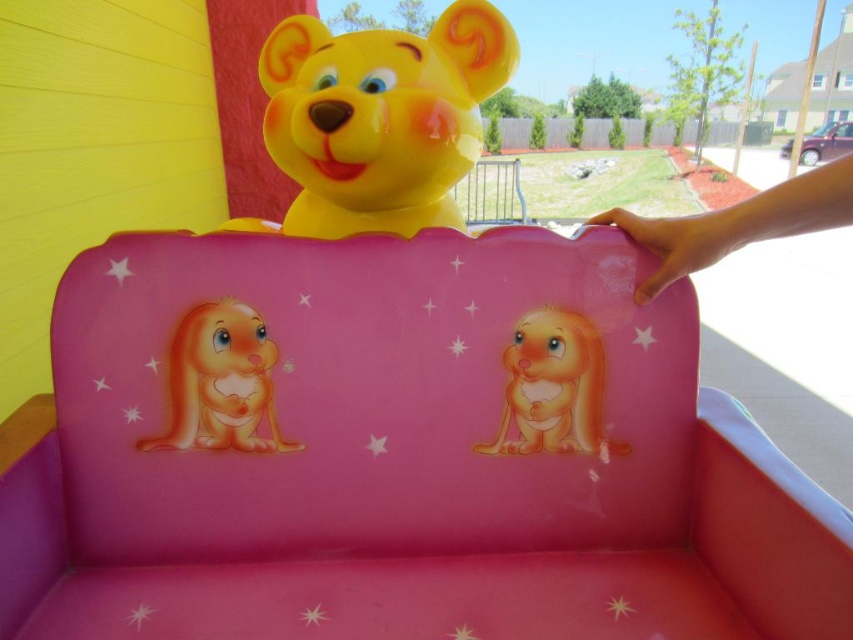
Question: Among these objects, which one is farthest from the camera?

Choices:
 (A) glossy plastic bunny at left
 (B) matte orange plush rabbit at center

Answer: (B)

Question: Can you confirm if pink plastic chair at center is wider than matte orange plush rabbit at center?

Choices:
 (A) yes
 (B) no

Answer: (A)

Question: Among these points, which one is nearest to the camera?

Choices:
 (A) (265, 364)
 (B) (666, 525)
 (C) (448, 19)
 (D) (512, 346)

Answer: (A)

Question: Does pink plastic chair at center appear over matte orange plush rabbit at center?

Choices:
 (A) yes
 (B) no

Answer: (B)

Question: Is glossy plastic bunny at left to the right of matte orange plush rabbit at center from the viewer's perspective?

Choices:
 (A) no
 (B) yes

Answer: (A)

Question: Among these objects, which one is farthest from the camera?

Choices:
 (A) matte orange plush rabbit at center
 (B) glossy plastic bunny at left
 (C) matte yellow plastic teddy bear at upper center

Answer: (A)